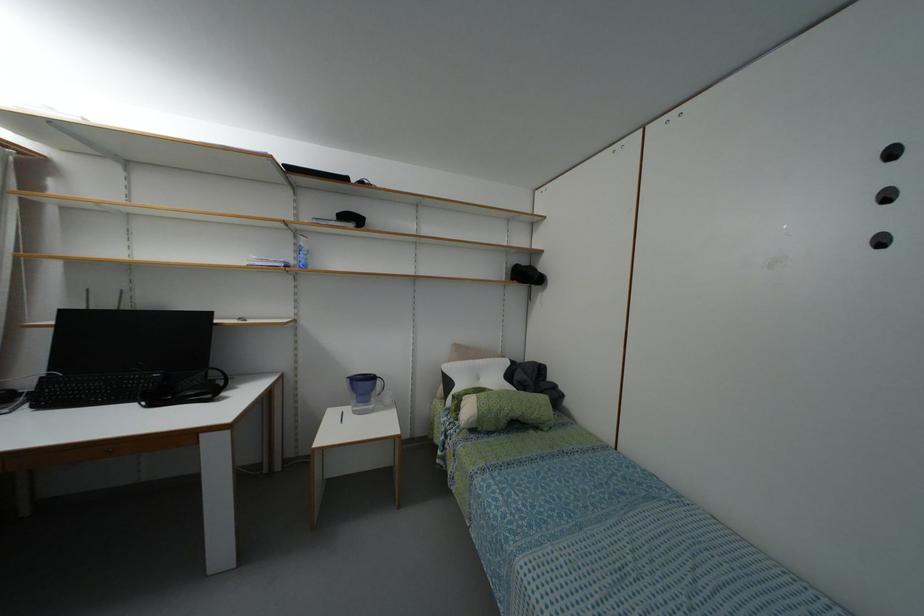
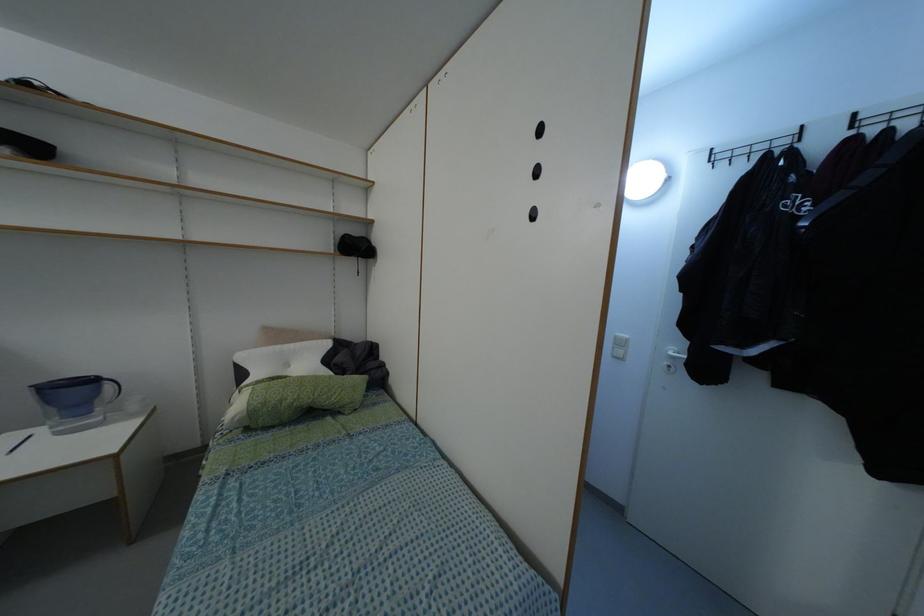
Question: Which direction would the cameraman need to move to produce the second image? Reply with the corresponding letter.

Choices:
 (A) Left
 (B) Right
 (C) Forward
 (D) Backward

Answer: (B)